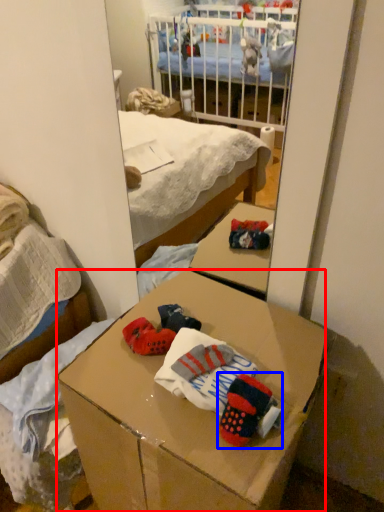
Question: Among these objects, which one is farthest to the camera, desk (highlighted by a red box) or toy (highlighted by a blue box)?

Choices:
 (A) desk
 (B) toy

Answer: (B)